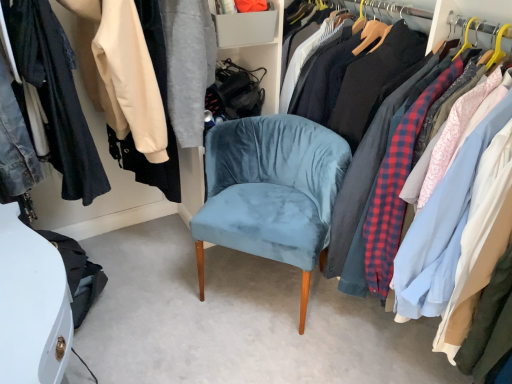
Question: Considering the relative positions of velvet blue chair at center and velvet blue chair at center in the image provided, is velvet blue chair at center to the left of velvet blue chair at center from the viewer's perspective?

Choices:
 (A) no
 (B) yes

Answer: (B)

Question: Does velvet blue chair at center have a greater width compared to velvet blue chair at center?

Choices:
 (A) no
 (B) yes

Answer: (A)

Question: Does velvet blue chair at center have a greater height compared to velvet blue chair at center?

Choices:
 (A) no
 (B) yes

Answer: (A)

Question: From the image's perspective, is velvet blue chair at center above velvet blue chair at center?

Choices:
 (A) yes
 (B) no

Answer: (A)

Question: Does velvet blue chair at center turn towards velvet blue chair at center?

Choices:
 (A) yes
 (B) no

Answer: (B)

Question: Would you say velvet blue chair at center is a long distance from velvet blue chair at center?

Choices:
 (A) no
 (B) yes

Answer: (A)

Question: Can you confirm if velvet blue chair at center is positioned to the left of velvet blue chair at center?

Choices:
 (A) yes
 (B) no

Answer: (B)

Question: From a real-world perspective, is velvet blue chair at center beneath velvet blue chair at center?

Choices:
 (A) no
 (B) yes

Answer: (A)

Question: Is velvet blue chair at center further to the viewer compared to velvet blue chair at center?

Choices:
 (A) no
 (B) yes

Answer: (A)

Question: Is velvet blue chair at center bigger than velvet blue chair at center?

Choices:
 (A) yes
 (B) no

Answer: (A)

Question: Is velvet blue chair at center outside of velvet blue chair at center?

Choices:
 (A) no
 (B) yes

Answer: (B)

Question: Are velvet blue chair at center and velvet blue chair at center located far from each other?

Choices:
 (A) no
 (B) yes

Answer: (A)

Question: From the image's perspective, is velvet blue chair at center above or below velvet blue chair at center?

Choices:
 (A) below
 (B) above

Answer: (A)